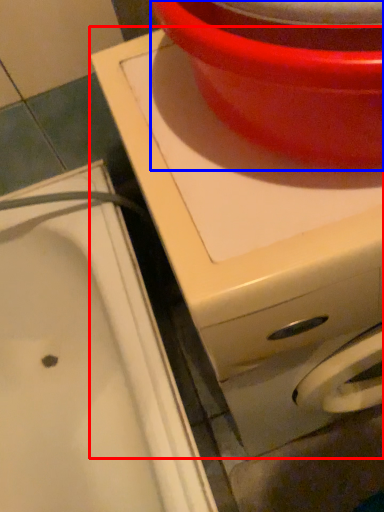
Question: Which of the following is the farthest to the observer, appliance (highlighted by a red box) or basin (highlighted by a blue box)?

Choices:
 (A) appliance
 (B) basin

Answer: (A)